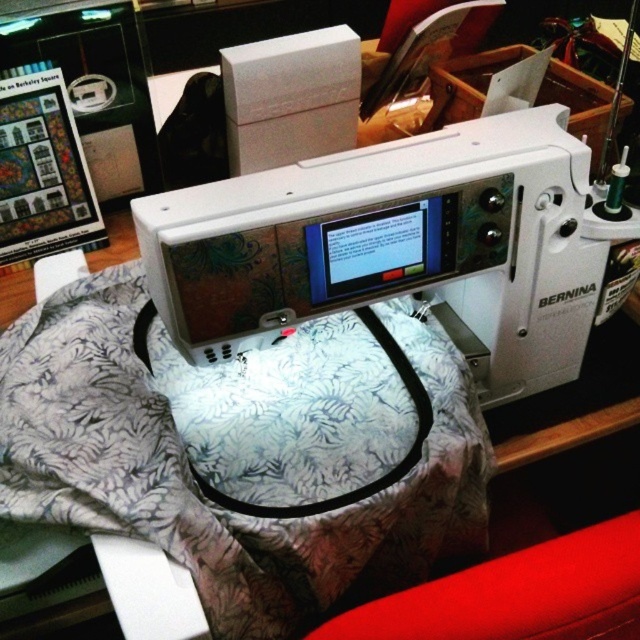
You are a tailor working on the sewing machine and need to access both fabrics. Which fabric is closer to you, the white floral fabric at center or the red fabric at lower right?

The white floral fabric at center is closer to you because the red fabric at lower right is behind it.

You are a tailor who needs to place a red fabric at lower right on top of the white plastic sewing machine at center. Can you do this without the fabric falling off?

The white plastic sewing machine at center is much taller than the red fabric at lower right, so placing the fabric on top might be unstable and could cause it to fall off. It is not advisable to place the fabric there.